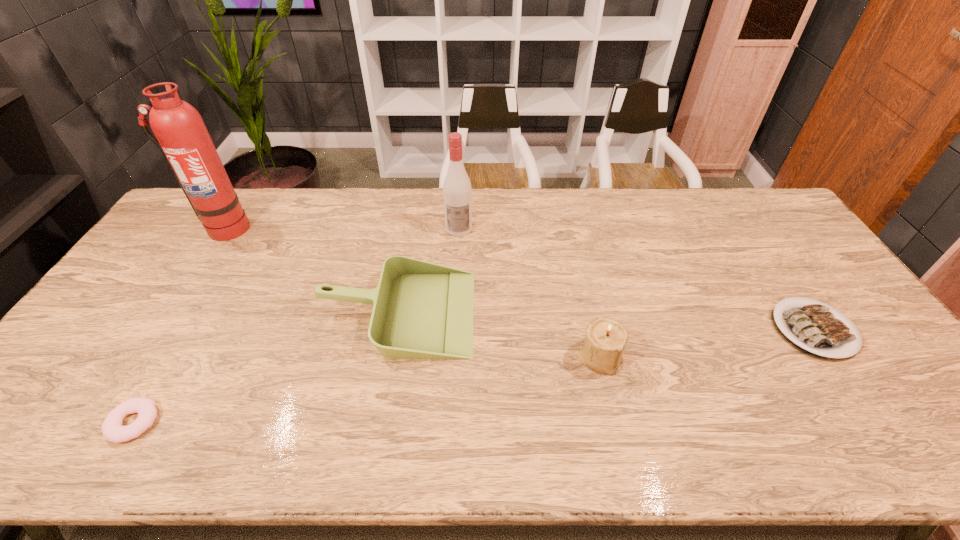
Find the location of a particular element. Image resolution: width=960 pixels, height=540 pixels. vacant area that lies between the doughnut and the alcohol is located at coordinates (297, 326).

Point out which object is positioned as the third nearest to the rightmost object. Please provide its 2D coordinates. Your answer should be formatted as a tuple, i.e. [(x, y)], where the tuple contains the x and y coordinates of a point satisfying the conditions above.

[(457, 192)]

The width and height of the screenshot is (960, 540). Find the location of `the closest object to the second tallest object`. the closest object to the second tallest object is located at coordinates (421, 310).

The height and width of the screenshot is (540, 960). In order to click on blank area in the image that satisfies the following two spatial constraints: 1. on the scoop of the dustpan; 2. on the front side of the doughnut in this screenshot , I will do `click(379, 422)`.

Locate an element on the screen. Image resolution: width=960 pixels, height=540 pixels. free space that satisfies the following two spatial constraints: 1. on the label side of the tallest object; 2. on the left side of the nearest object is located at coordinates (97, 422).

The width and height of the screenshot is (960, 540). I want to click on free space that satisfies the following two spatial constraints: 1. on the back side of the fourth shortest object; 2. on the scoop of the dustpan, so click(589, 312).

Identify the location of vacant region that satisfies the following two spatial constraints: 1. on the label of the second tallest object; 2. on the right side of the plate. The height and width of the screenshot is (540, 960). (454, 329).

Locate an element on the screen. This screenshot has width=960, height=540. free space in the image that satisfies the following two spatial constraints: 1. on the scoop of the dustpan; 2. on the left side of the third tallest object is located at coordinates (391, 356).

Identify the location of vacant space that satisfies the following two spatial constraints: 1. on the label of the plate; 2. on the left side of the fifth shortest object. (454, 329).

The width and height of the screenshot is (960, 540). Identify the location of vacant region that satisfies the following two spatial constraints: 1. on the back side of the plate; 2. on the right side of the fourth shortest object. (593, 329).